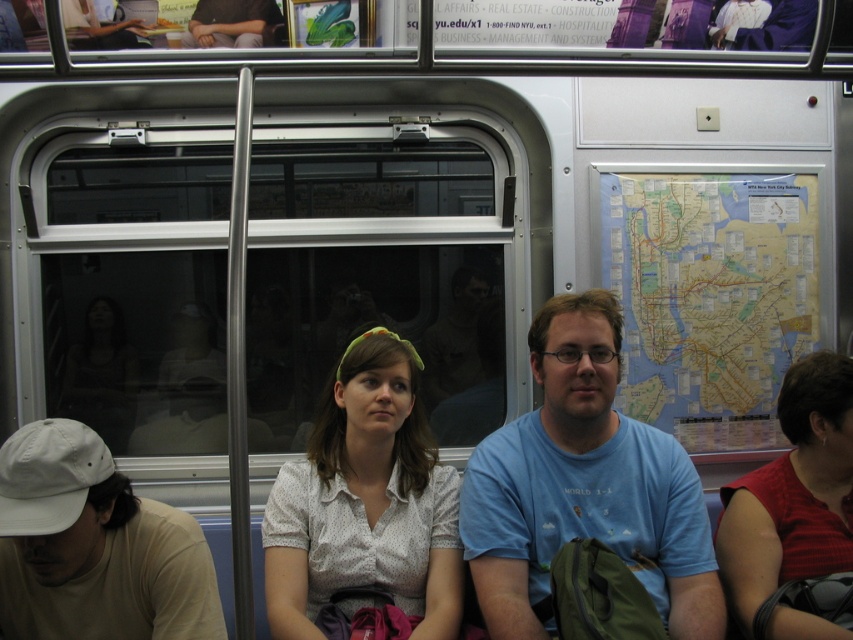
Is paper map at right shorter than matte black shirt at center?

No.

Consider the image. Is the position of paper map at right less distant than that of matte black shirt at center?

That is False.

Locate an element on the screen. The width and height of the screenshot is (853, 640). paper map at right is located at coordinates (711, 298).

Does blue cotton t-shirt at center appear over paper map at right?

Incorrect, blue cotton t-shirt at center is not positioned above paper map at right.

How far apart are blue cotton t-shirt at center and paper map at right?

blue cotton t-shirt at center is 22.39 inches away from paper map at right.

Which is in front, point (672, 467) or point (682, 205)?

Point (672, 467) is more forward.

You are a GUI agent. You are given a task and a screenshot of the screen. Output one action in this format:
    pyautogui.click(x=<x>, y=<y>)
    Task: Click on the blue cotton t-shirt at center
    The image size is (853, 640).
    Given the screenshot: What is the action you would take?
    pyautogui.click(x=584, y=486)

Who is higher up, beige cotton t-shirt at lower left or matte red shirt at right?

matte red shirt at right is above.

Does beige cotton t-shirt at lower left appear under matte red shirt at right?

Result: Yes.

Does point (67, 513) come closer to viewer compared to point (793, 477)?

Yes, it is.

This screenshot has height=640, width=853. In order to click on beige cotton t-shirt at lower left in this screenshot , I will do `click(94, 547)`.